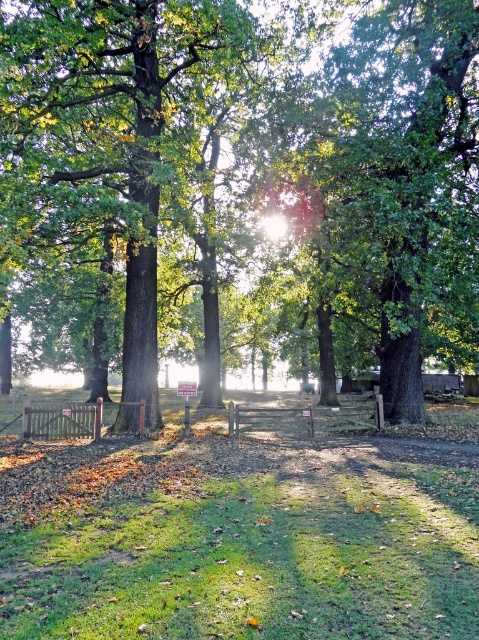
Question: Which object appears closest to the camera in this image?

Choices:
 (A) green leafy tree at center
 (B) green grass at center

Answer: (B)

Question: Is green leafy tree at center further to camera compared to green grass at center?

Choices:
 (A) yes
 (B) no

Answer: (A)

Question: Is green leafy tree at center above green grass at center?

Choices:
 (A) no
 (B) yes

Answer: (B)

Question: Which object is closer to the camera taking this photo?

Choices:
 (A) green leafy tree at center
 (B) green grass at center

Answer: (B)

Question: Is green leafy tree at center wider than green grass at center?

Choices:
 (A) yes
 (B) no

Answer: (A)